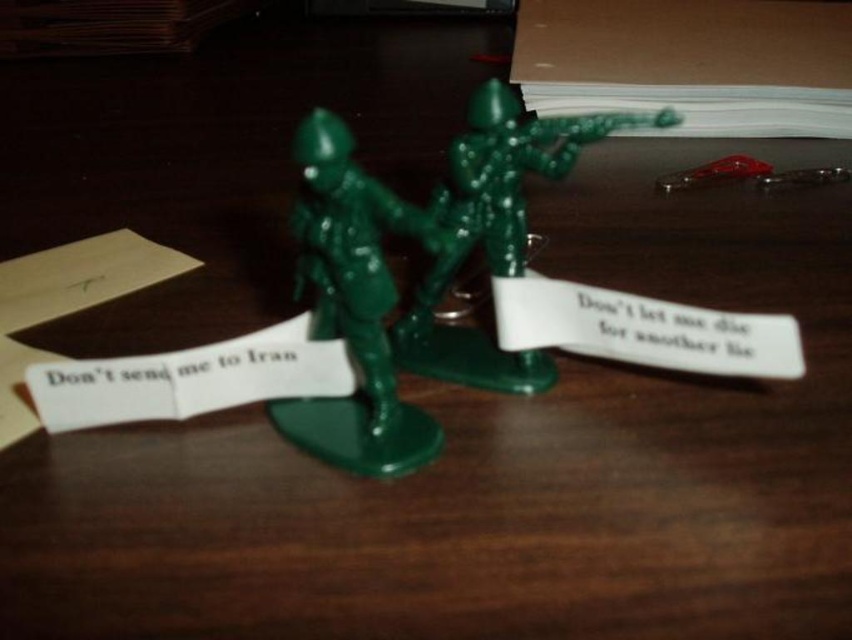
Question: Is green plastic toy soldiers at center above green plastic toy soldier at center?

Choices:
 (A) no
 (B) yes

Answer: (A)

Question: Can you confirm if green plastic toy soldiers at center is positioned above green plastic toy soldier at center?

Choices:
 (A) no
 (B) yes

Answer: (A)

Question: Which object appears farthest from the camera in this image?

Choices:
 (A) green plastic toy soldier at center
 (B) green plastic toy soldiers at center

Answer: (A)

Question: Which of the following is the closest to the observer?

Choices:
 (A) (456, 248)
 (B) (309, 269)

Answer: (B)

Question: Which point is farther to the camera?

Choices:
 (A) green plastic toy soldier at center
 (B) green plastic toy soldiers at center

Answer: (A)

Question: From the image, what is the correct spatial relationship of green plastic toy soldiers at center in relation to green plastic toy soldier at center?

Choices:
 (A) left
 (B) right

Answer: (A)